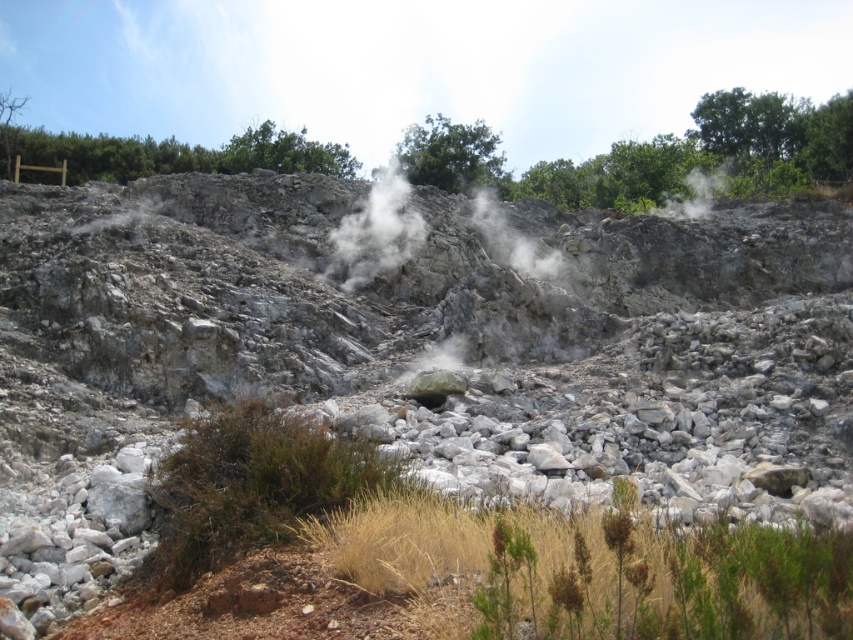
Question: Is white vapor at center bigger than white smoke at upper center?

Choices:
 (A) yes
 (B) no

Answer: (A)

Question: Which object is closer to the camera taking this photo?

Choices:
 (A) white smoke at upper center
 (B) white vapor at center

Answer: (B)

Question: Does white vapor at center have a lesser width compared to white smoke at upper center?

Choices:
 (A) yes
 (B) no

Answer: (A)

Question: Considering the relative positions of white vapor at center and white smoke at upper center in the image provided, where is white vapor at center located with respect to white smoke at upper center?

Choices:
 (A) right
 (B) left

Answer: (B)

Question: Which point is farther to the camera?

Choices:
 (A) (370, 218)
 (B) (674, 193)

Answer: (B)